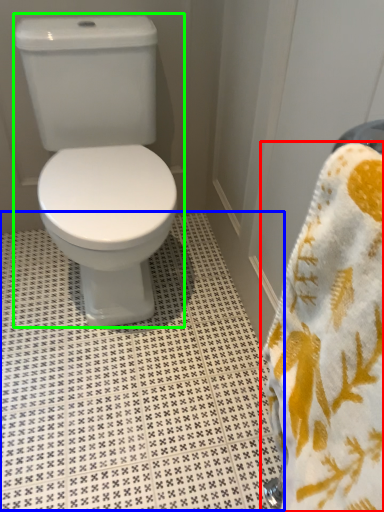
Question: Based on their relative distances, which object is farther from towel (highlighted by a red box)? Choose from tile (highlighted by a blue box) and toilet (highlighted by a green box).

Choices:
 (A) tile
 (B) toilet

Answer: (B)